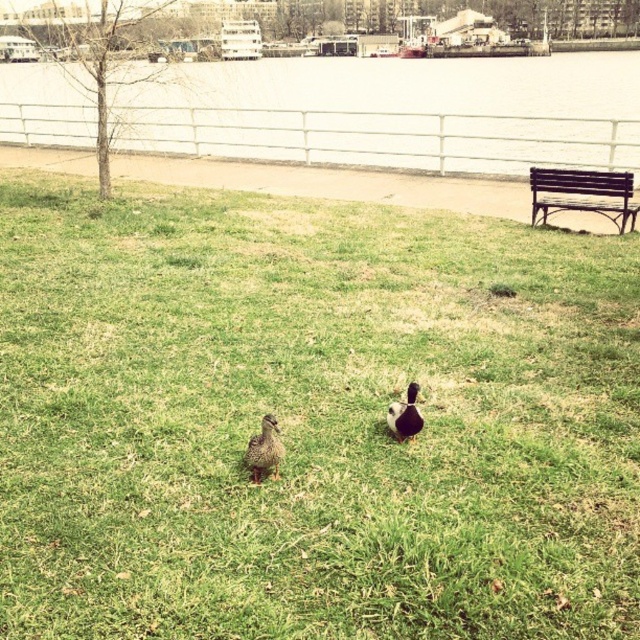
Question: Can you confirm if green grassy at center is positioned above white metal fence at upper center?

Choices:
 (A) yes
 (B) no

Answer: (B)

Question: Which object is closer to the camera taking this photo?

Choices:
 (A) brown speckled feathers at center
 (B) brown fuzzy duck at center
 (C) white metal fence at upper center

Answer: (A)

Question: Does wooden bench at center appear under brown fuzzy duck at center?

Choices:
 (A) no
 (B) yes

Answer: (A)

Question: Is white metal fence at upper center thinner than brown fuzzy duck at center?

Choices:
 (A) yes
 (B) no

Answer: (B)

Question: Based on their relative distances, which object is nearer to the brown speckled feathers at center?

Choices:
 (A) white metal fence at upper center
 (B) brown fuzzy duck at center

Answer: (B)

Question: Which object is closer to the camera taking this photo?

Choices:
 (A) green grassy at center
 (B) brown speckled feathers at center
 (C) wooden bench at center

Answer: (A)